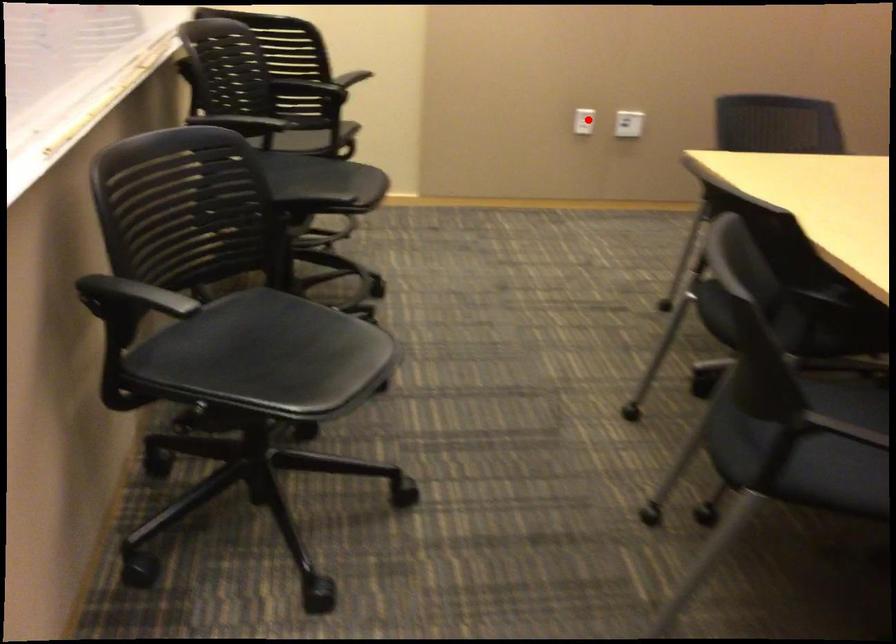
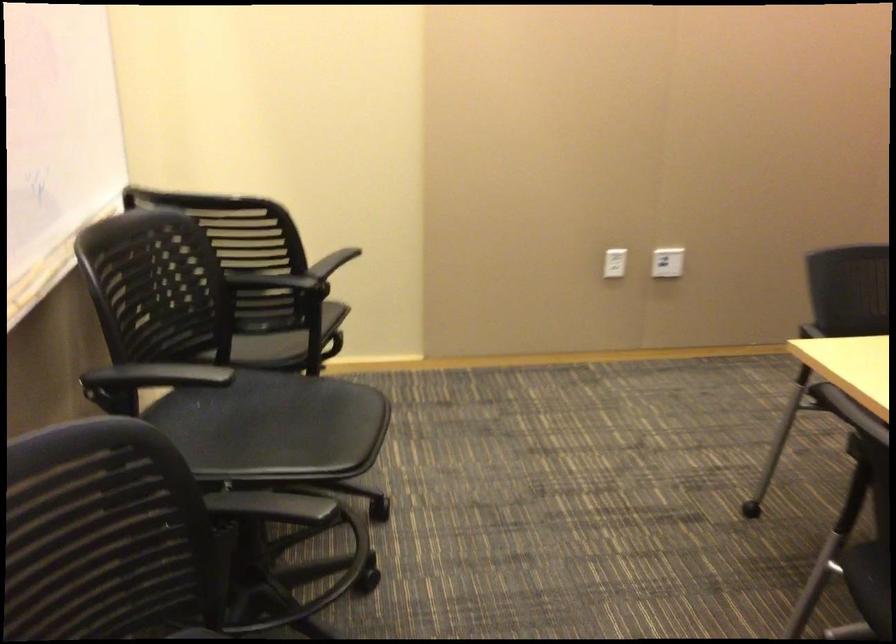
Question: I am providing you with two images of the same scene from different viewpoints. Given a red point in image1, look at the same physical point in image2. Is it:

Choices:
 (A) Closer to the viewpoint
 (B) Farther from the viewpoint

Answer: (A)